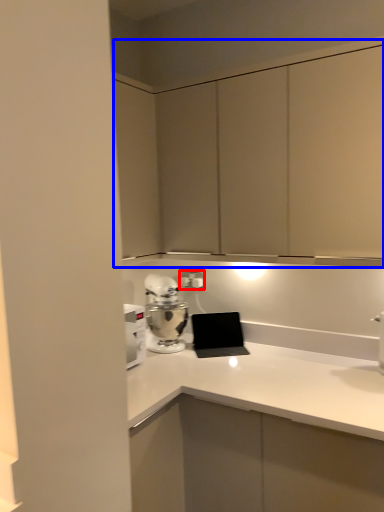
Question: Which object is further to the camera taking this photo, electric outlet (highlighted by a red box) or dresser (highlighted by a blue box)?

Choices:
 (A) electric outlet
 (B) dresser

Answer: (A)